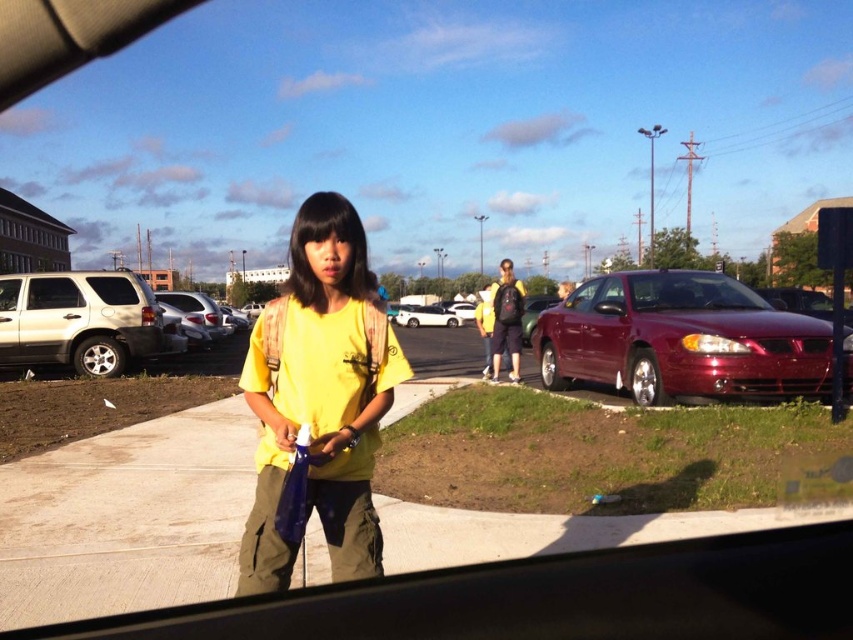
You are driving a car and want to park in the parking lot shown. You need to know which vehicle takes up more space between the glossy red car window at center and the white matte van at center. Which one requires more space?

The white matte van at center requires more space because it has a greater width than the glossy red car window at center.

You are driving a car that is 4 meters long and need to park in the parking lot shown. The parking space between the glossy red car window at center and the white matte van at center is available. Can your car fit in this space?

The distance between the glossy red car window at center and the white matte van at center is 31.78 meters. Since your car is only 4 meters long, there is ample space for it to fit comfortably within the parking space.

You are sitting in the driver seat of the vehicle and see two points marked in the parking lot through the windshield. Which point, point (642, 296) or point (434, 316), is closer to you?

Point (642, 296) is closer to the camera than point (434, 316).